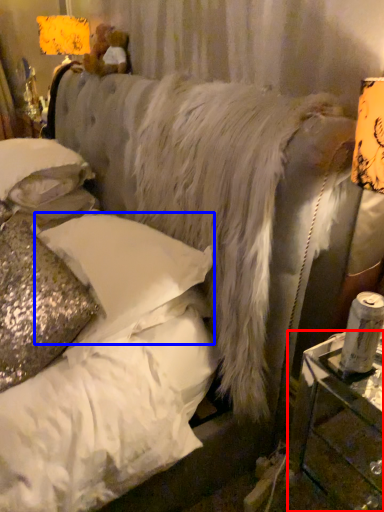
Question: Which object is closer to the camera taking this photo, table (highlighted by a red box) or pillow (highlighted by a blue box)?

Choices:
 (A) table
 (B) pillow

Answer: (A)